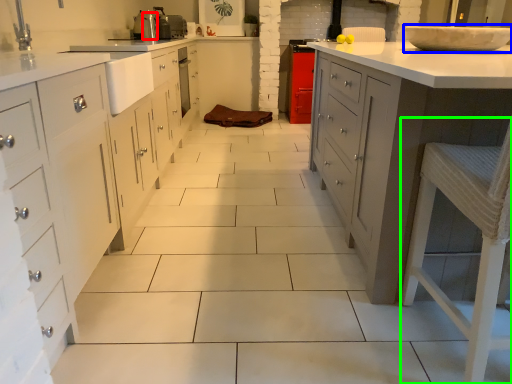
Question: Based on their relative distances, which object is farther from appliance (highlighted by a red box)? Choose from home appliance (highlighted by a blue box) and bar stool (highlighted by a green box).

Choices:
 (A) home appliance
 (B) bar stool

Answer: (B)